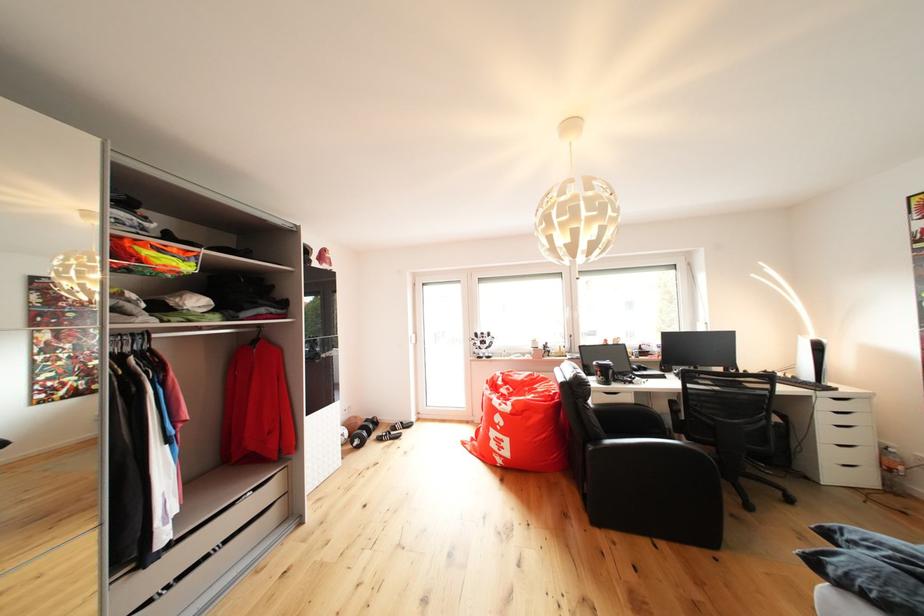
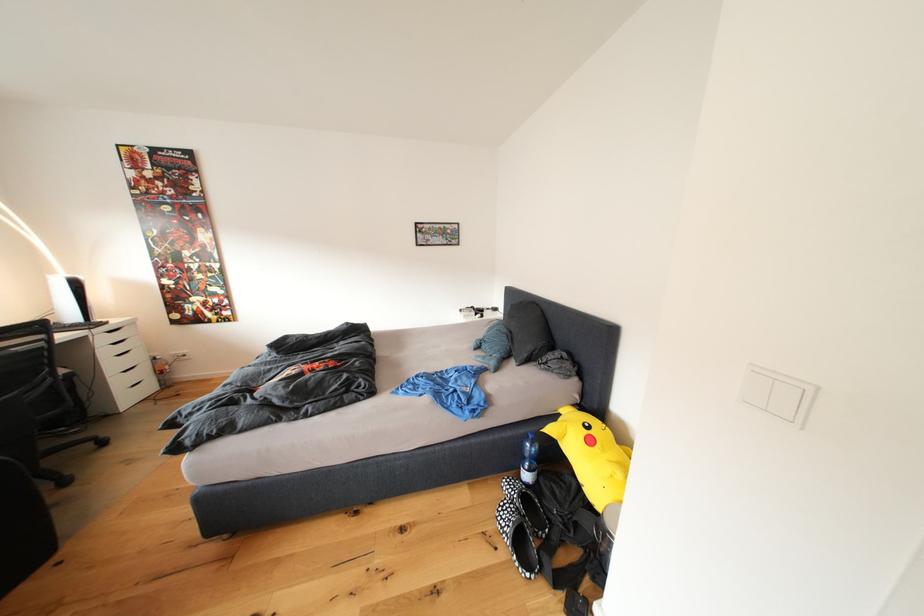
Locate, in the second image, the point that corresponds to (x=776, y=423) in the first image.

(63, 378)